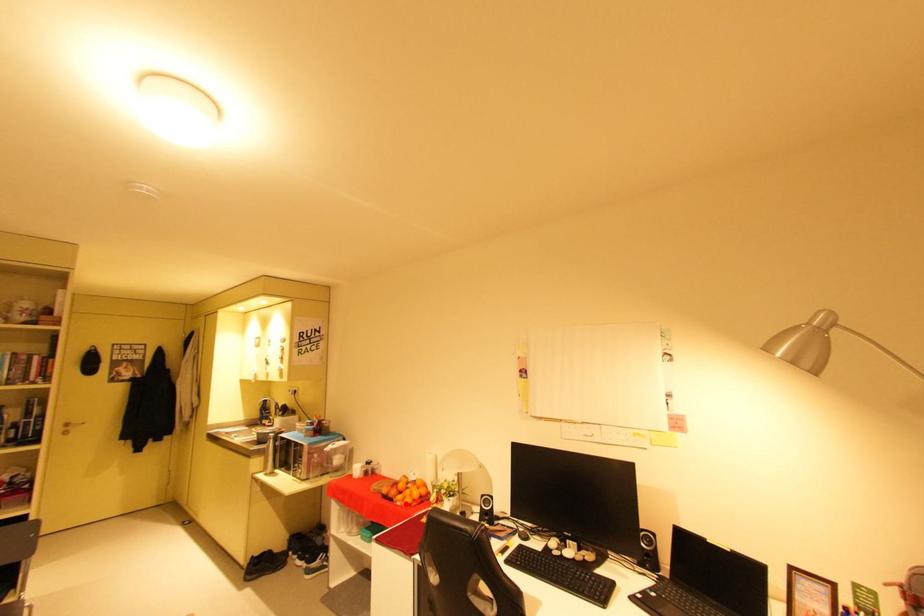
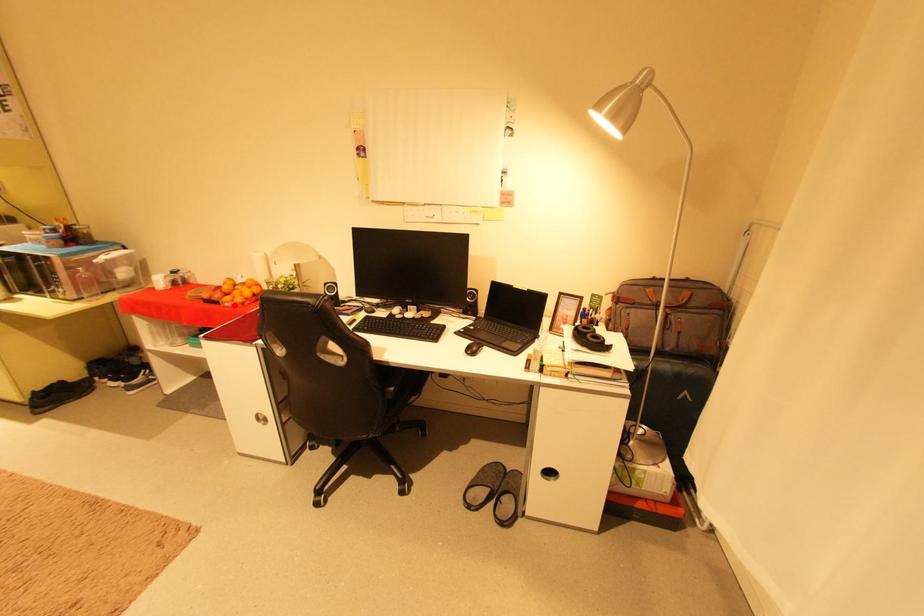
I am providing you with two images of the same scene from different viewpoints. A red point is marked on the first image and another point is marked on the second image. Does the point marked in image1 correspond to the same location as the one in image2?

Yes